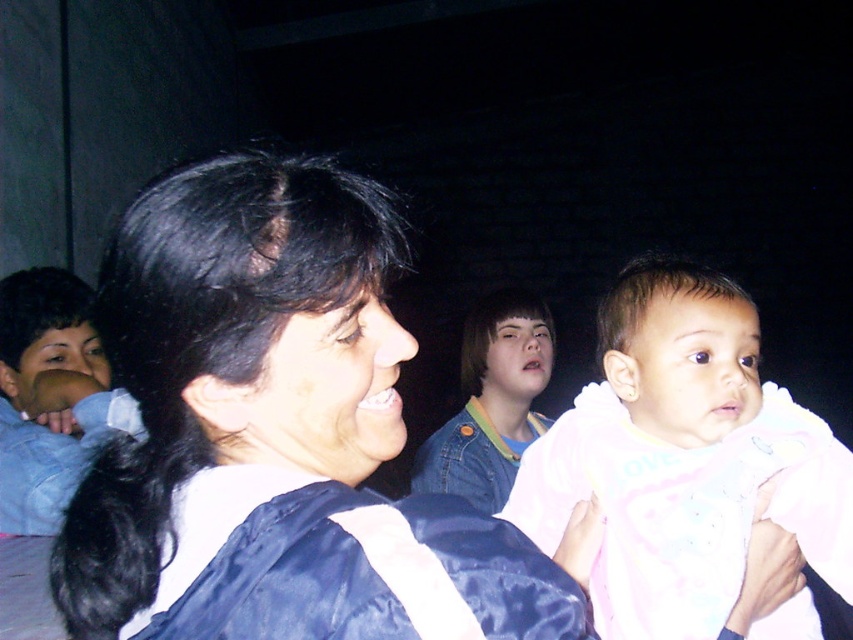
Does pink soft fabric baby at center lie behind blue denim jacket at left?

That is False.

Does pink soft fabric baby at center appear on the left side of blue denim jacket at left?

Incorrect, pink soft fabric baby at center is not on the left side of blue denim jacket at left.

Does point (705, 504) come behind point (20, 416)?

No, (705, 504) is in front of (20, 416).

Locate an element on the screen. pink soft fabric baby at center is located at coordinates (682, 458).

Is blue denim jacket at left to the left of denim jacket at center from the viewer's perspective?

Yes, blue denim jacket at left is to the left of denim jacket at center.

Who is more distant from viewer, (33,433) or (543,308)?

Positioned behind is point (543,308).

I want to click on blue denim jacket at left, so click(x=50, y=396).

Does shiny blue jacket at center appear on the left side of pink soft fabric baby at center?

Indeed, shiny blue jacket at center is positioned on the left side of pink soft fabric baby at center.

Identify the location of shiny blue jacket at center. The height and width of the screenshot is (640, 853). [276, 435].